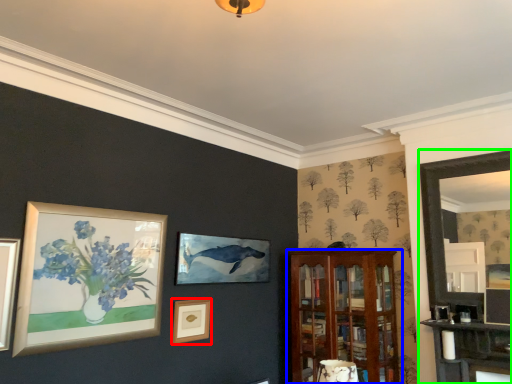
Question: Which object is positioned closest to picture frame (highlighted by a red box)? Select from shelf (highlighted by a blue box) and fireplace (highlighted by a green box).

Choices:
 (A) shelf
 (B) fireplace

Answer: (A)